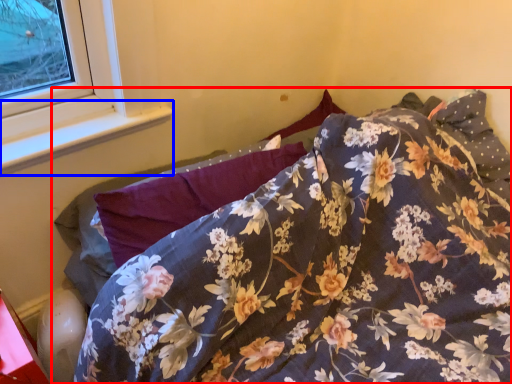
Question: Which of the following is the closest to the observer, bed (highlighted by a red box) or window sill (highlighted by a blue box)?

Choices:
 (A) bed
 (B) window sill

Answer: (A)